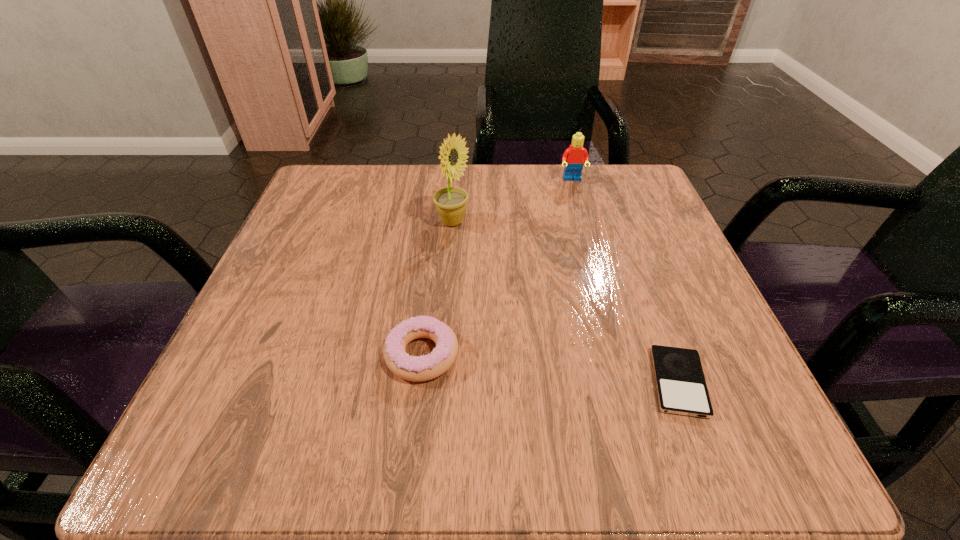
This screenshot has width=960, height=540. In the image, there is a desktop. Identify the location of vacant space at the near left corner. (248, 449).

The image size is (960, 540). Identify the location of vacant space at the far right corner of the desktop. (588, 164).

Where is `vacant space at the near right corner of the desktop`? vacant space at the near right corner of the desktop is located at coordinates (749, 442).

What are the coordinates of `free space between the sunflower and the doughnut` in the screenshot? It's located at (437, 288).

At what (x,y) coordinates should I click in order to perform the action: click on free space between the farthest object and the iPod. Please return your answer as a coordinate pair (x, y). The width and height of the screenshot is (960, 540). Looking at the image, I should click on (625, 281).

This screenshot has width=960, height=540. Identify the location of vacant space that is in between the shortest object and the second shortest object. (550, 368).

Locate an element on the screen. The width and height of the screenshot is (960, 540). unoccupied area between the third tallest object and the sunflower is located at coordinates point(437,288).

Find the location of a particular element. This screenshot has width=960, height=540. unoccupied area between the iPod and the doughnut is located at coordinates (550, 368).

This screenshot has height=540, width=960. I want to click on free space between the third nearest object and the farthest object, so click(x=513, y=201).

This screenshot has height=540, width=960. In order to click on empty space between the doughnut and the Lego in this screenshot , I will do `click(497, 267)`.